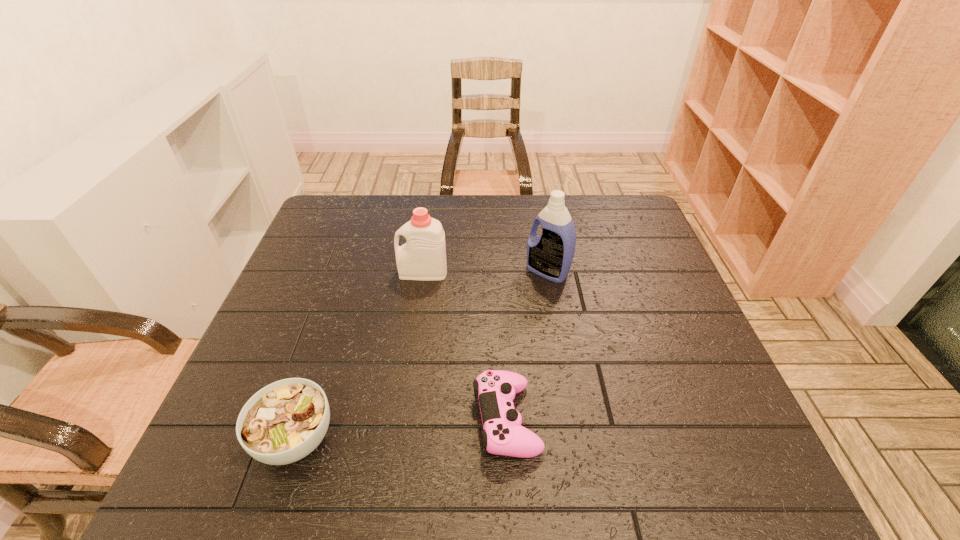
Where is `the tallest object`? The height and width of the screenshot is (540, 960). the tallest object is located at coordinates (550, 255).

The width and height of the screenshot is (960, 540). In order to click on the taller detergent in this screenshot , I will do `click(550, 255)`.

Find the location of a particular element. The width and height of the screenshot is (960, 540). the second object from left to right is located at coordinates (423, 257).

Where is `the left detergent`? The width and height of the screenshot is (960, 540). the left detergent is located at coordinates (423, 257).

Where is `the leftmost object`? This screenshot has width=960, height=540. the leftmost object is located at coordinates (285, 421).

What are the coordinates of `the second shortest object` in the screenshot? It's located at (285, 421).

Where is `control`? The image size is (960, 540). control is located at coordinates (503, 434).

The height and width of the screenshot is (540, 960). I want to click on the shortest object, so click(503, 434).

You are a GUI agent. You are given a task and a screenshot of the screen. Output one action in this format:
    pyautogui.click(x=<x>, y=<y>)
    Task: Click on the vacant space located on the left of the rightmost object
    The image size is (960, 540).
    Given the screenshot: What is the action you would take?
    pyautogui.click(x=413, y=272)

Locate an element on the screen. This screenshot has width=960, height=540. vacant region located on the handle side of the shorter detergent is located at coordinates (340, 273).